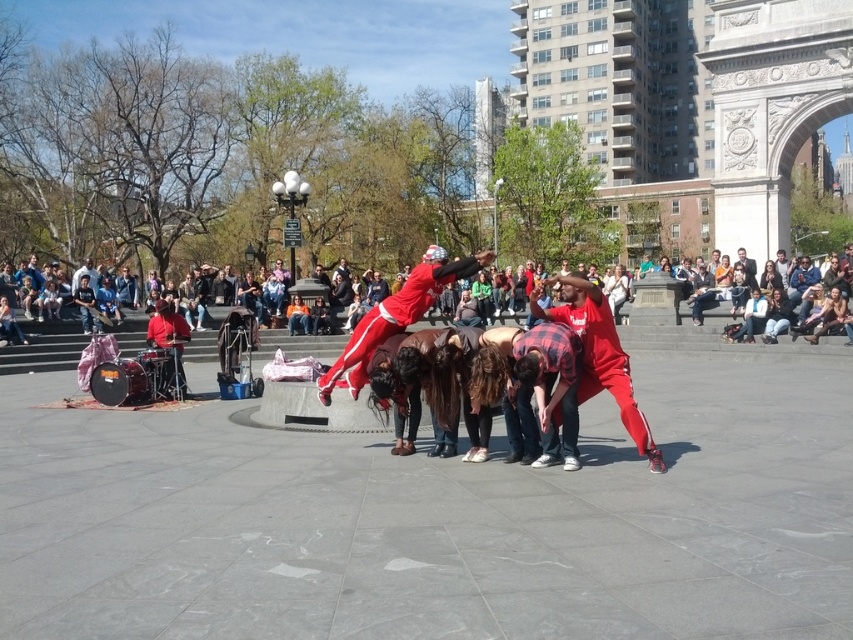
You are a photographer positioned at the edge of the square, aiming to capture a wide shot of the performers. Given that your camera has a maximum focus range of 10 meters, will you be able to clearly photograph both the red plaid shirt at center and the matte red pants at center in the same frame?

The distance between the red plaid shirt at center and the matte red pants at center is 8.96 meters. Since your camera can focus up to 10 meters, both objects will be within the focus range and can be clearly photographed in the same frame.

You are standing at the entrance of the public square and want to take a photo of the matte red clothing at center. Based on your position, where should you aim your camera to capture the object in focus?

The matte red clothing at center is located at point (665, 321), so you should aim your camera at that coordinate to capture it in focus.

You are a photographer trying to capture a photo of the performers in the center of the scene. You notice two red items at the center of the image. Which one is wider, the matte red clothing at center or the red plaid shirt at center?

The matte red clothing at center is wider than the red plaid shirt at center according to the description.